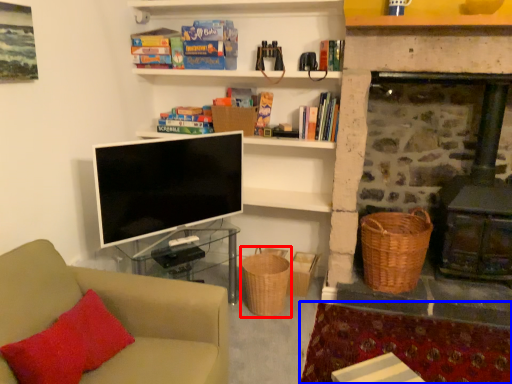
Question: Among these objects, which one is nearest to the camera, basket (highlighted by a red box) or plain (highlighted by a blue box)?

Choices:
 (A) basket
 (B) plain

Answer: (B)